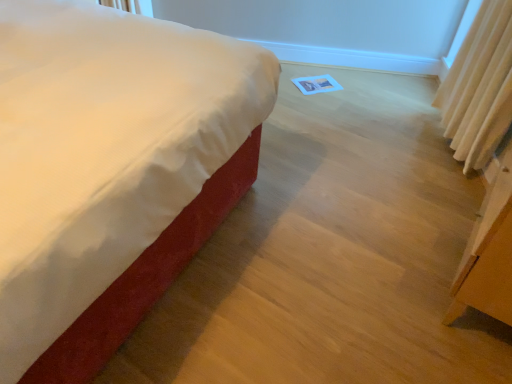
Question: Is satin white bed at center a part of beige fabric curtain at right?

Choices:
 (A) no
 (B) yes

Answer: (A)

Question: Can you confirm if beige fabric curtain at right is shorter than satin white bed at center?

Choices:
 (A) no
 (B) yes

Answer: (B)

Question: Is beige fabric curtain at right outside of satin white bed at center?

Choices:
 (A) no
 (B) yes

Answer: (B)

Question: Is beige fabric curtain at right bigger than satin white bed at center?

Choices:
 (A) no
 (B) yes

Answer: (A)

Question: Is beige fabric curtain at right wider than satin white bed at center?

Choices:
 (A) yes
 (B) no

Answer: (B)

Question: Is beige fabric curtain at right not near satin white bed at center?

Choices:
 (A) yes
 (B) no

Answer: (A)

Question: Is satin white bed at center taller than beige fabric curtain at right?

Choices:
 (A) no
 (B) yes

Answer: (B)

Question: Is satin white bed at center smaller than beige fabric curtain at right?

Choices:
 (A) no
 (B) yes

Answer: (A)

Question: Is the position of satin white bed at center more distant than that of beige fabric curtain at right?

Choices:
 (A) yes
 (B) no

Answer: (B)

Question: From the image's perspective, is satin white bed at center on beige fabric curtain at right?

Choices:
 (A) no
 (B) yes

Answer: (A)

Question: Does satin white bed at center have a lesser height compared to beige fabric curtain at right?

Choices:
 (A) yes
 (B) no

Answer: (B)

Question: Does satin white bed at center touch beige fabric curtain at right?

Choices:
 (A) yes
 (B) no

Answer: (B)

Question: Is satin white bed at center in front of or behind beige fabric curtain at right in the image?

Choices:
 (A) behind
 (B) front

Answer: (B)